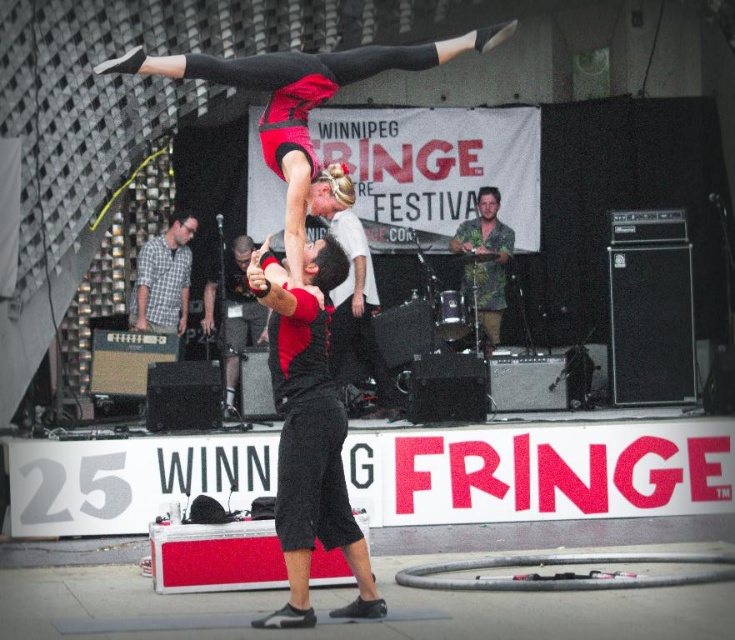
Question: Can you confirm if plaid shirt at center is smaller than black matte shorts at center?

Choices:
 (A) no
 (B) yes

Answer: (B)

Question: Which object is the farthest from the black matte shorts at center?

Choices:
 (A) green textured shirt at center
 (B) plaid shirt at center

Answer: (A)

Question: Which of the following is the closest to the observer?

Choices:
 (A) (462, 253)
 (B) (190, 275)
 (C) (243, 240)

Answer: (C)

Question: Observing the image, what is the correct spatial positioning of black matte shorts at center in reference to green textured shirt at center?

Choices:
 (A) left
 (B) right

Answer: (A)

Question: Which of the following is the farthest from the observer?

Choices:
 (A) green textured shirt at center
 (B) plaid shirt at center

Answer: (A)

Question: Is plaid shirt at center thinner than green textured shirt at center?

Choices:
 (A) yes
 (B) no

Answer: (A)